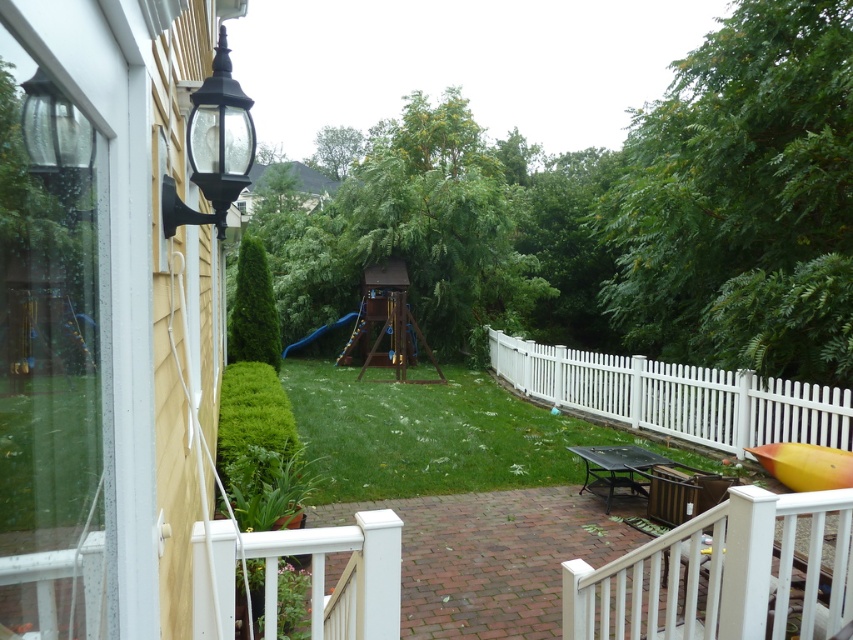
You are standing inside the house looking out through the glass door. There are two points marked in the backyard. The first point is at coordinates point [219,173] and the second point is at point [328,326]. Which of these two points is closer to you?

Point [219,173] is in front of point [328,326], so it is closer to you.

You are a delivery person holding a large package that requires a 2.5 meter clearance to maneuver. You need to place it on the white painted wood porch at lower center. Can you safely maneuver the package through the space available?

The distance of white painted wood porch at lower center from camera is 2.32 meters, which is less than the required 2.5 meters clearance. Therefore, the package cannot be safely maneuvered through the space available.

You are designing a new backyard layout and want to ensure that the black glass lamp at upper left and the blue rubber slide at center are spaced appropriately. Considering their sizes, which object requires more horizontal space for placement?

The blue rubber slide at center requires more horizontal space for placement since it is wider than the black glass lamp at upper left.